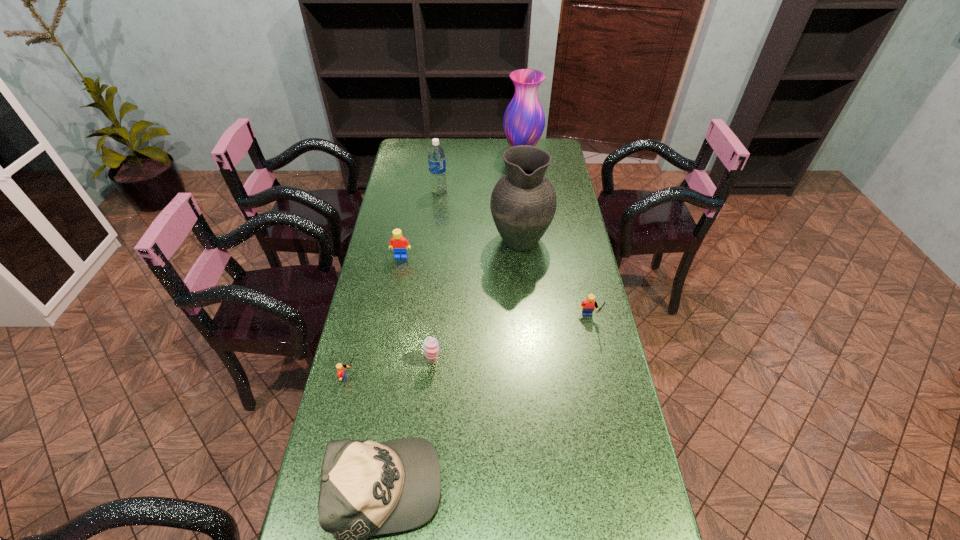
Find the location of a particular element. This screenshot has width=960, height=540. the left yellow Lego is located at coordinates (341, 374).

This screenshot has width=960, height=540. Find the location of `the nearer yellow Lego`. the nearer yellow Lego is located at coordinates (341, 374).

Locate an element on the screen. Image resolution: width=960 pixels, height=540 pixels. vacant region located 0.200m on the front of the vase is located at coordinates (526, 190).

Locate an element on the screen. The width and height of the screenshot is (960, 540). free region located on the side of the pitcher with the handle is located at coordinates pyautogui.click(x=513, y=166).

In order to click on vacant space located 0.300m on the side of the pitcher with the handle in this screenshot , I will do `click(514, 174)`.

At what (x,y) coordinates should I click in order to perform the action: click on vacant space situated 0.320m on the side of the pitcher with the handle. Please return your answer as a coordinate pair (x, y). This screenshot has height=540, width=960. Looking at the image, I should click on (514, 171).

Where is `vacant space located 0.330m on the right of the water bottle`? The height and width of the screenshot is (540, 960). vacant space located 0.330m on the right of the water bottle is located at coordinates (x=529, y=191).

Where is `vacant space positioned on the face of the red Lego`? vacant space positioned on the face of the red Lego is located at coordinates (386, 340).

At what (x,y) coordinates should I click in order to perform the action: click on free space located on the front-facing side of the rightmost Lego. Please return your answer as a coordinate pair (x, y). Looking at the image, I should click on (597, 360).

Identify the location of vacant region located on the right of the sherbert. This screenshot has width=960, height=540. (556, 362).